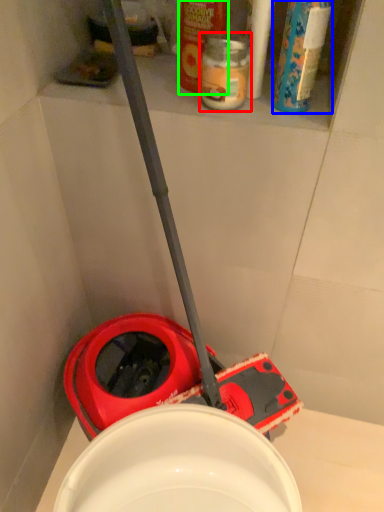
Question: Based on their relative distances, which object is nearer to bottle (highlighted by a red box)? Choose from cleaning product (highlighted by a blue box) and cleaning product (highlighted by a green box).

Choices:
 (A) cleaning product
 (B) cleaning product

Answer: (B)